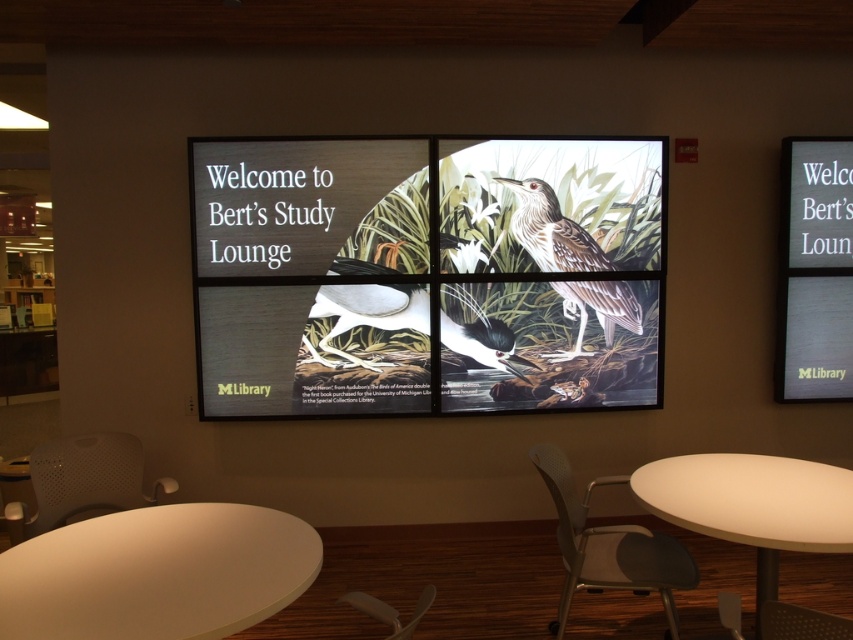
Between matte wooden signboard at center and gray plastic chair at lower center, which one has less height?

Standing shorter between the two is gray plastic chair at lower center.

How distant is matte wooden signboard at center from gray plastic chair at lower center?

A distance of 1.23 meters exists between matte wooden signboard at center and gray plastic chair at lower center.

Does point (483, 253) come farther from viewer compared to point (666, 536)?

Yes, point (483, 253) is behind point (666, 536).

Locate an element on the screen. This screenshot has width=853, height=640. matte wooden signboard at center is located at coordinates (427, 275).

Can you confirm if silver metallic sign at upper right is positioned above white plastic chair at lower center?

Yes, silver metallic sign at upper right is above white plastic chair at lower center.

What do you see at coordinates (815, 269) in the screenshot? I see `silver metallic sign at upper right` at bounding box center [815, 269].

In order to click on silver metallic sign at upper right in this screenshot , I will do `click(815, 269)`.

Does gray plastic chair at lower center appear over white plastic chair at lower center?

Incorrect, gray plastic chair at lower center is not positioned above white plastic chair at lower center.

Is gray plastic chair at lower center positioned before white plastic chair at lower center?

No, it is behind white plastic chair at lower center.

What do you see at coordinates (608, 547) in the screenshot?
I see `gray plastic chair at lower center` at bounding box center [608, 547].

You are a GUI agent. You are given a task and a screenshot of the screen. Output one action in this format:
    pyautogui.click(x=<x>, y=<y>)
    Task: Click on the gray plastic chair at lower center
    
    Given the screenshot: What is the action you would take?
    pyautogui.click(x=608, y=547)